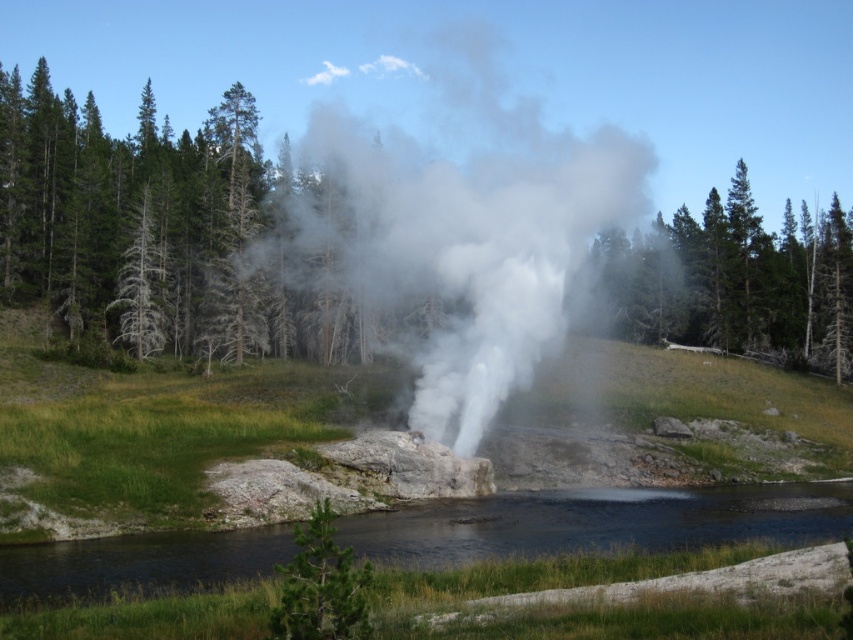
You are a drone operator trying to capture a photo of the geyser in the center. You need to ensure the green matte tree at upper right does not block the view. Based on its coordinates, is the tree positioned to the left or right of the center of the image?

The green matte tree at upper right is at point 0.439 on the x and 0.868 on the y. Since the x coordinate is less than 0.5, it is positioned to the left of the center of the image.

You are a hiker who wants to take a photo of the white vapor steam at center and the green textured tree at center. Since you have a wide angle lens, can you capture both objects in the same frame?

The white vapor steam at center is above the green textured tree at center, so yes, you can capture both in the same frame using the wide angle lens since they are vertically aligned.

You are standing at the point closer to the geyser in the center. Which point are you at, point (709,289) or point (335,556)?

You are at point (335,556) because it is closer to the geyser in the center than point (709,289) which is further away.